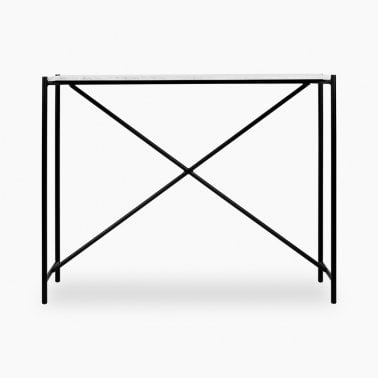
Locate an element on the screen. The height and width of the screenshot is (378, 378). marble is located at coordinates (163, 75).